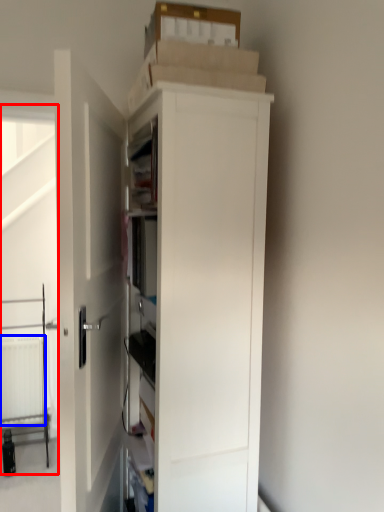
Question: Which of the following is the farthest to the observer, screen door (highlighted by a red box) or radiator (highlighted by a blue box)?

Choices:
 (A) screen door
 (B) radiator

Answer: (B)